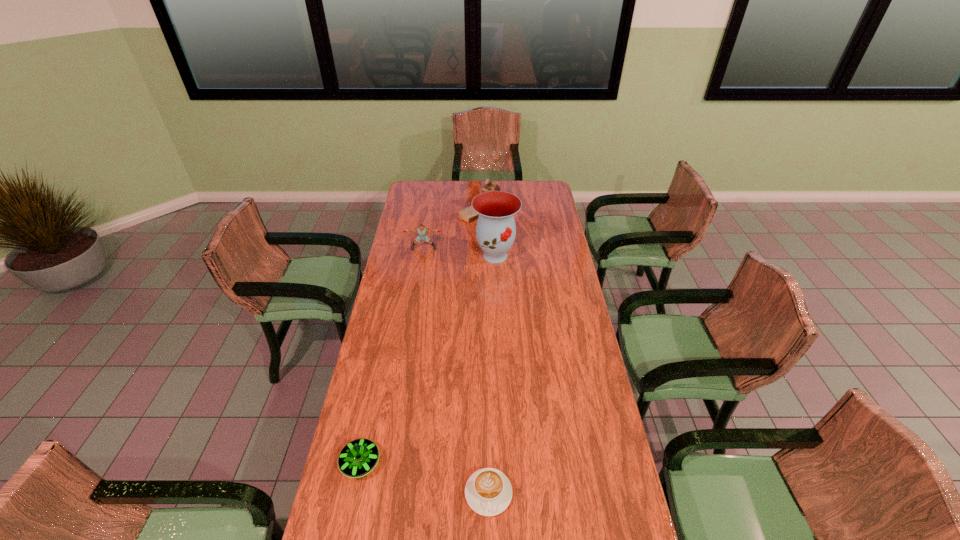
The image size is (960, 540). I want to click on vacant area situated 0.230m on the front-facing side of the third shortest object, so click(x=419, y=282).

I want to click on free space located 0.200m on the right of the saucer, so pyautogui.click(x=445, y=463).

The height and width of the screenshot is (540, 960). In order to click on free space located on the side of the cappuccino with the handle in this screenshot , I will do `click(490, 537)`.

Identify the location of object positioned at the far edge. (468, 214).

You are a GUI agent. You are given a task and a screenshot of the screen. Output one action in this format:
    pyautogui.click(x=<x>, y=<y>)
    Task: Click on the puncher located in the left edge section of the desktop
    
    Given the screenshot: What is the action you would take?
    pyautogui.click(x=422, y=231)

This screenshot has height=540, width=960. In order to click on saucer located in the left edge section of the desktop in this screenshot , I will do `click(359, 457)`.

At what (x,y) coordinates should I click in order to perform the action: click on free space at the left edge. Please return your answer as a coordinate pair (x, y). Looking at the image, I should click on (420, 263).

At what (x,y) coordinates should I click in order to perform the action: click on vacant region at the right edge of the desktop. Please return your answer as a coordinate pair (x, y). Looking at the image, I should click on (588, 357).

In the image, there is a desktop. Identify the location of vacant space at the far left corner. This screenshot has height=540, width=960. (408, 201).

Where is `free spot between the third tallest object and the tallest object`? This screenshot has width=960, height=540. free spot between the third tallest object and the tallest object is located at coordinates (460, 252).